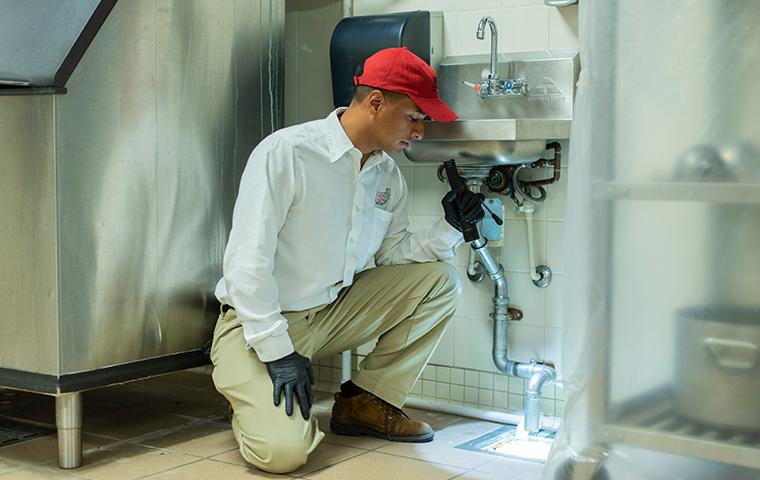
The height and width of the screenshot is (480, 760). I want to click on hot water tap, so click(x=476, y=87).